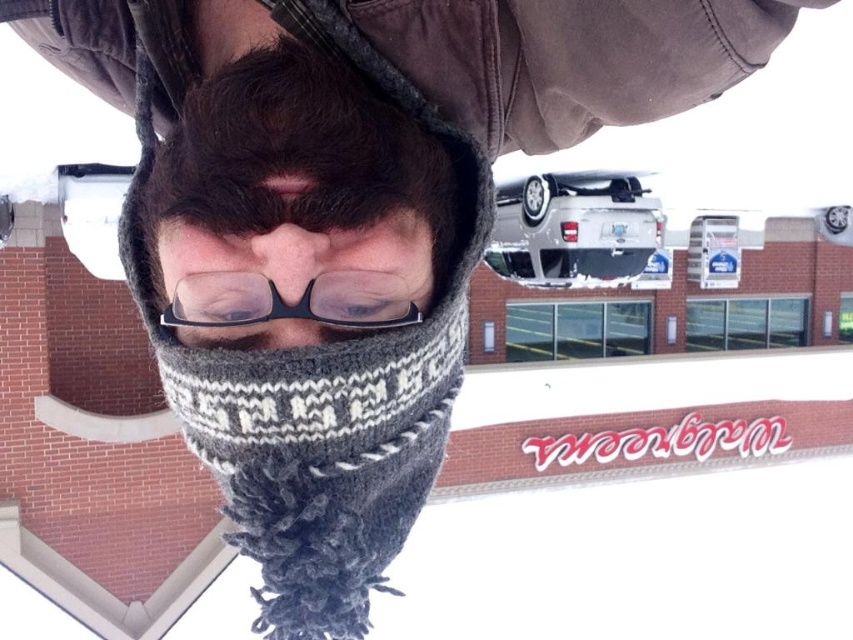
You are a photographer trying to capture a clear shot of the Mazda sign in the background. The person in the image is blocking your view. Which object should you move first to get a better angle? The knitted wool scarf at center or the clear plastic glasses at center?

You should move the knitted wool scarf at center first because it is positioned to the right of the clear plastic glasses at center, so moving it would provide a clearer path to the Mazda sign.

You are a photographer trying to capture the Mazda dealership sign in the background while focusing on the person in the scene. The person has two scarves around their neck and face. Which scarf is closer to the camera, the knitted wool scarf at center or the knitted gray scarf at center?

The knitted gray scarf at center is closer to the camera because it is positioned above the knitted wool scarf at center.